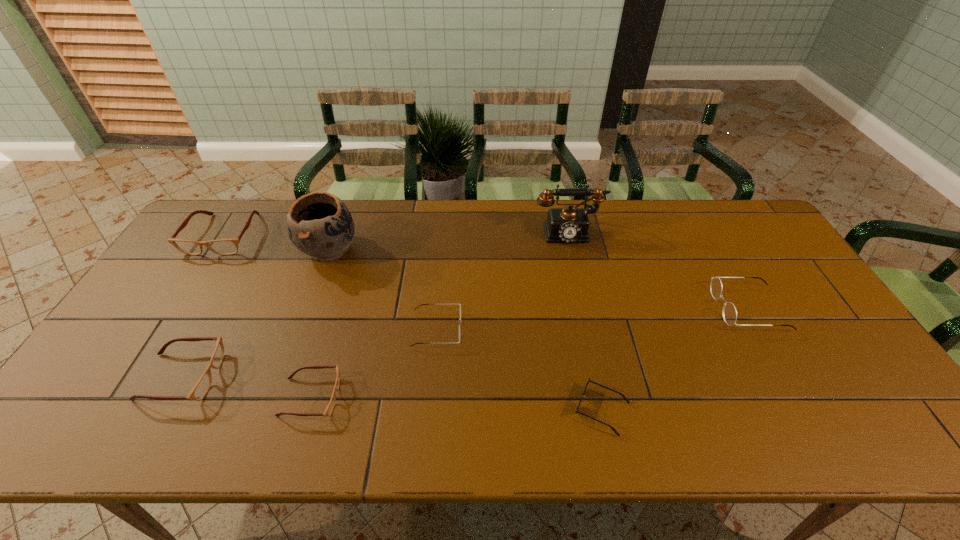
Image resolution: width=960 pixels, height=540 pixels. In order to click on the rightmost brown spectacles in this screenshot , I will do `click(329, 409)`.

At what (x,y) coordinates should I click in order to perform the action: click on sunglasses. Please return your answer as a coordinate pair (x, y). Looking at the image, I should click on (589, 380).

What are the coordinates of `black sunglasses` in the screenshot? It's located at (589, 380).

Locate an element on the screen. This screenshot has width=960, height=540. vacant space located on the front of the telephone at the rotary dial is located at coordinates (588, 325).

Locate an element on the screen. vacant space located 0.100m on the back of the pottery is located at coordinates (343, 210).

What are the coordinates of `vacant space located on the front-facing side of the farthest brown spectacles` in the screenshot? It's located at (153, 346).

Where is `vacant area located on the front-facing side of the rightmost object`? The width and height of the screenshot is (960, 540). vacant area located on the front-facing side of the rightmost object is located at coordinates (620, 308).

Locate an element on the screen. vacant space situated on the front-facing side of the rightmost object is located at coordinates (681, 308).

Where is `vacant space located on the front-facing side of the rightmost object`? This screenshot has height=540, width=960. vacant space located on the front-facing side of the rightmost object is located at coordinates (684, 308).

The width and height of the screenshot is (960, 540). What are the coordinates of `vacant area situated 0.080m on the front-facing side of the second smallest brown spectacles` in the screenshot? It's located at (251, 377).